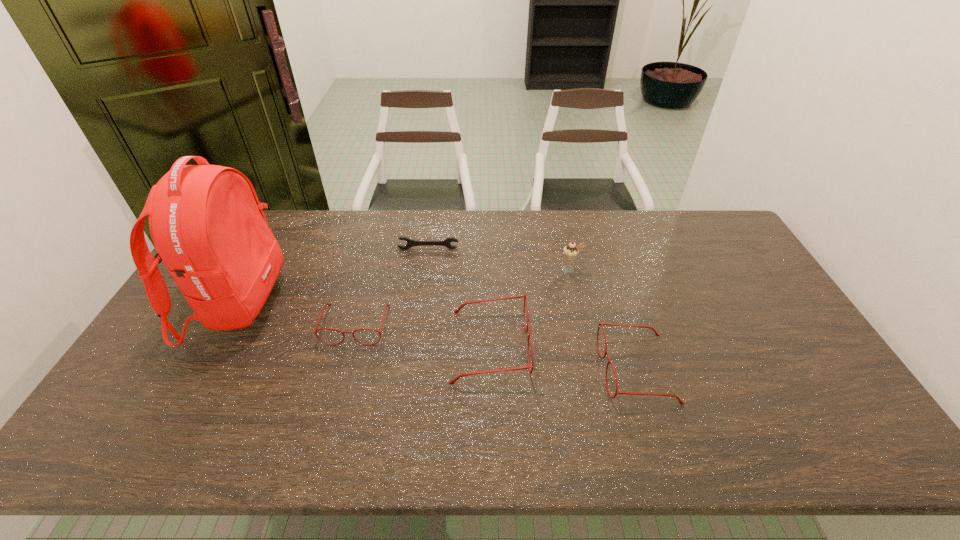
I want to click on vacant space that's between the wrench and the second spectacles from right to left, so click(x=459, y=298).

You are a GUI agent. You are given a task and a screenshot of the screen. Output one action in this format:
    pyautogui.click(x=<x>, y=<y>)
    Task: Click on the free spot between the icecream and the second spectacles from right to left
    
    Given the screenshot: What is the action you would take?
    pyautogui.click(x=530, y=308)

Locate an element on the screen. The image size is (960, 540). free space between the second shortest object and the second shortest spectacles is located at coordinates (496, 347).

Find the location of a particular element. empty location between the leftmost object and the fifth tallest object is located at coordinates (298, 314).

At what (x,y) coordinates should I click in order to perform the action: click on vacant region between the farthest object and the shortest spectacles. Please return your answer as a coordinate pair (x, y). The width and height of the screenshot is (960, 540). Looking at the image, I should click on (392, 287).

I want to click on unoccupied position between the rightmost spectacles and the icecream, so click(x=604, y=320).

The width and height of the screenshot is (960, 540). What are the coordinates of `object that is the third closest to the second shortest object` in the screenshot? It's located at (410, 243).

Identify which object is located as the fourth nearest to the second spectacles from left to right. Please provide its 2D coordinates. Your answer should be formatted as a tuple, i.e. [(x, y)], where the tuple contains the x and y coordinates of a point satisfying the conditions above.

[(410, 243)]

Find the location of a particular element. spectacles that can be found as the third closest to the farthest object is located at coordinates (606, 352).

Identify which spectacles is the third closest to the backpack. Please provide its 2D coordinates. Your answer should be formatted as a tuple, i.e. [(x, y)], where the tuple contains the x and y coordinates of a point satisfying the conditions above.

[(606, 352)]